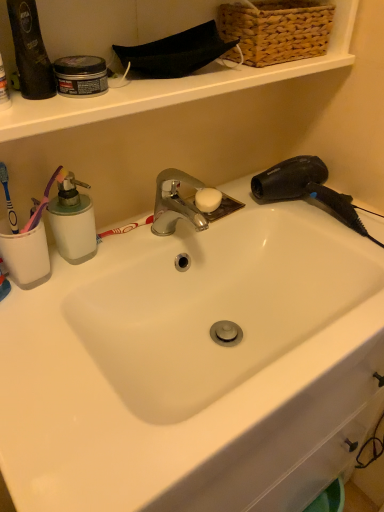
Question: Does white plastic soap dispenser at left have a smaller size compared to blue plastic toothbrush at left?

Choices:
 (A) yes
 (B) no

Answer: (B)

Question: Is blue plastic toothbrush at left inside white plastic soap dispenser at left?

Choices:
 (A) no
 (B) yes

Answer: (A)

Question: From a real-world perspective, is white plastic soap dispenser at left over blue plastic toothbrush at left?

Choices:
 (A) yes
 (B) no

Answer: (B)

Question: Is white plastic soap dispenser at left behind blue plastic toothbrush at left?

Choices:
 (A) yes
 (B) no

Answer: (A)

Question: From the image's perspective, is white plastic soap dispenser at left below blue plastic toothbrush at left?

Choices:
 (A) yes
 (B) no

Answer: (A)

Question: Is the position of white plastic soap dispenser at left less distant than that of blue plastic toothbrush at left?

Choices:
 (A) yes
 (B) no

Answer: (B)

Question: Is black plastic hair dryer at upper right oriented away from white ceramic sink at center?

Choices:
 (A) yes
 (B) no

Answer: (B)

Question: Is black plastic hair dryer at upper right with white ceramic sink at center?

Choices:
 (A) yes
 (B) no

Answer: (B)

Question: Is black plastic hair dryer at upper right wider than white ceramic sink at center?

Choices:
 (A) yes
 (B) no

Answer: (B)

Question: Is black plastic hair dryer at upper right bigger than white ceramic sink at center?

Choices:
 (A) yes
 (B) no

Answer: (B)

Question: Would you say black plastic hair dryer at upper right is outside white ceramic sink at center?

Choices:
 (A) no
 (B) yes

Answer: (B)

Question: Is black plastic hair dryer at upper right facing towards white ceramic sink at center?

Choices:
 (A) yes
 (B) no

Answer: (B)

Question: From the image's perspective, is white ceramic sink at center below black plastic hair dryer at upper right?

Choices:
 (A) yes
 (B) no

Answer: (A)